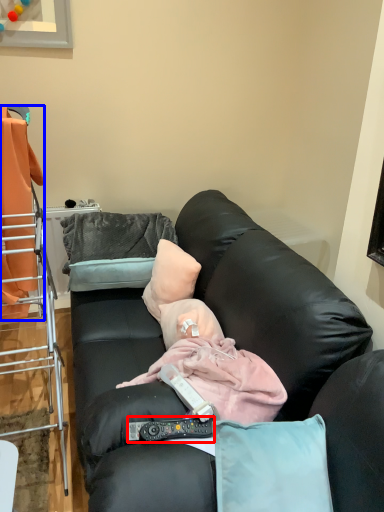
Question: Which point is closer to the camera, remote control (highlighted by a red box) or laundry (highlighted by a blue box)?

Choices:
 (A) remote control
 (B) laundry

Answer: (A)